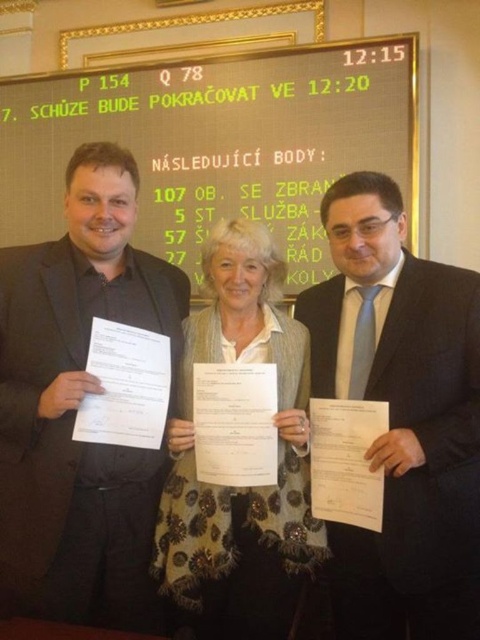
Is green digital display at upper center above floral-patterned scarf at center?

Correct, green digital display at upper center is located above floral-patterned scarf at center.

Identify the location of green digital display at upper center. This screenshot has width=480, height=640. (217, 141).

The height and width of the screenshot is (640, 480). What are the coordinates of `green digital display at upper center` in the screenshot? It's located at (217, 141).

Which is more to the right, dark suit at center or floral-patterned scarf at center?

dark suit at center

Measure the distance between dark suit at center and camera.

The distance of dark suit at center from camera is 5.97 feet.

Does point (420, 474) come closer to viewer compared to point (286, 344)?

Yes, it is in front of point (286, 344).

Find the location of `dark suit at center`. dark suit at center is located at coordinates (402, 417).

Is green digital display at upper center to the right of black suit at center from the viewer's perspective?

Correct, you'll find green digital display at upper center to the right of black suit at center.

Based on the photo, is the position of green digital display at upper center more distant than that of black suit at center?

Yes, it is behind black suit at center.

Measure the distance between green digital display at upper center and camera.

The distance of green digital display at upper center from camera is 3.07 meters.

Identify the location of green digital display at upper center. (217, 141).